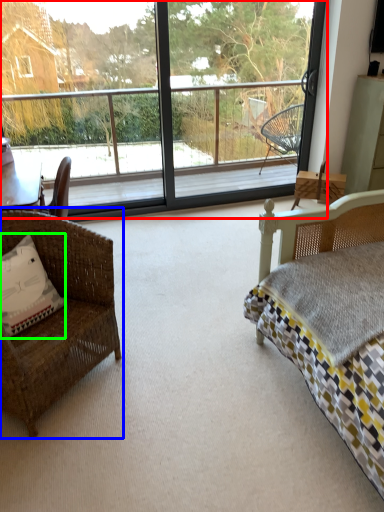
Question: Estimate the real-world distances between objects in this image. Which object is farther from window (highlighted by a red box), chair (highlighted by a blue box) or pillow (highlighted by a green box)?

Choices:
 (A) chair
 (B) pillow

Answer: (B)